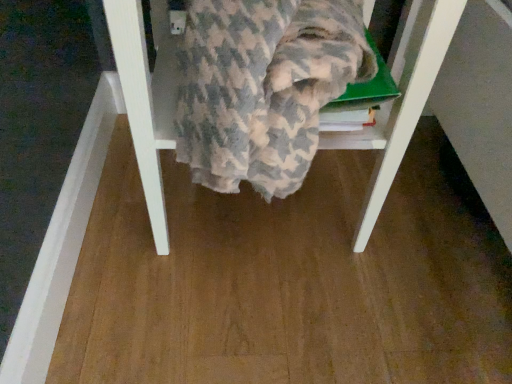
At what (x,y) coordinates should I click in order to perform the action: click on free space below textured fabric blanket at center (from a real-world perspective). Please return your answer as a coordinate pair (x, y). The height and width of the screenshot is (384, 512). Looking at the image, I should click on (260, 209).